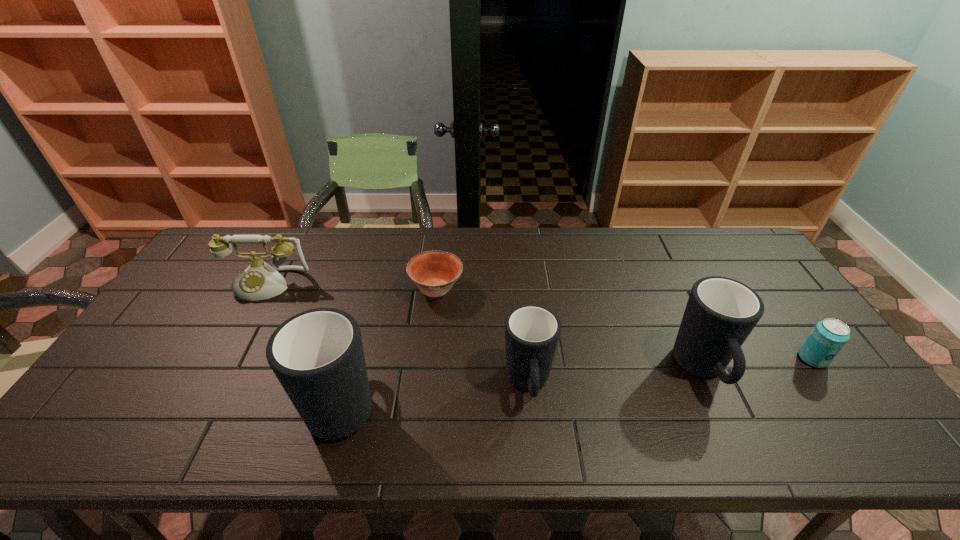
The height and width of the screenshot is (540, 960). Identify the location of free space that satisfies the following two spatial constraints: 1. on the dial of the fourth object from right to left; 2. on the left side of the telephone. (265, 289).

The width and height of the screenshot is (960, 540). I want to click on vacant area that satisfies the following two spatial constraints: 1. on the side of the second object from left to right with the handle; 2. on the right side of the beer can, so click(x=355, y=359).

Where is `free spot that satisfies the following two spatial constraints: 1. on the side of the second shortest object with the handle; 2. on the left side of the fifth object from right to left`? The width and height of the screenshot is (960, 540). free spot that satisfies the following two spatial constraints: 1. on the side of the second shortest object with the handle; 2. on the left side of the fifth object from right to left is located at coordinates (355, 359).

Locate an element on the screen. The height and width of the screenshot is (540, 960). blank area in the image that satisfies the following two spatial constraints: 1. on the side of the bowl with the handle; 2. on the left side of the leftmost mug is located at coordinates (373, 289).

This screenshot has height=540, width=960. In order to click on free space that satisfies the following two spatial constraints: 1. on the dial of the telephone; 2. on the right side of the rightmost object in this screenshot , I will do `click(228, 359)`.